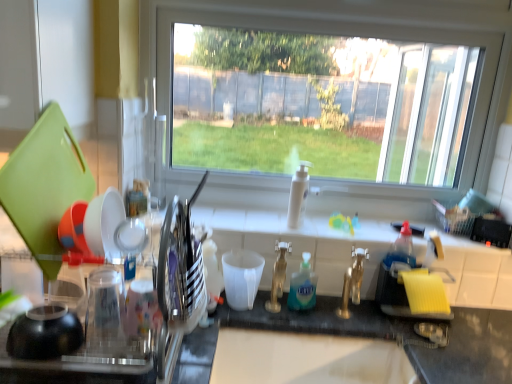
This screenshot has height=384, width=512. Describe the element at coordinates (303, 287) in the screenshot. I see `blue translucent liquid soap at center` at that location.

The width and height of the screenshot is (512, 384). I want to click on gold metallic faucet at center, so click(x=278, y=276).

What do you see at coordinates (180, 271) in the screenshot? This screenshot has height=384, width=512. I see `shiny silver utensil holder at left, the second tableware viewed from the left` at bounding box center [180, 271].

This screenshot has height=384, width=512. In order to click on clear plastic dish rack at left in this screenshot , I will do `click(45, 186)`.

What do you see at coordinates (352, 282) in the screenshot? The width and height of the screenshot is (512, 384). I see `gold metallic faucet at center` at bounding box center [352, 282].

Where is `blue translucent liquid soap at center`? The height and width of the screenshot is (384, 512). blue translucent liquid soap at center is located at coordinates (303, 287).

Considering their positions, is white matte measuring cup at center, the 1th tableware in the right-to-left sequence, located in front of or behind blue translucent liquid soap at center?

Visually, white matte measuring cup at center, the 1th tableware in the right-to-left sequence, is located in front of blue translucent liquid soap at center.

Can you tell me how much white matte measuring cup at center, the 3th tableware in the left-to-right sequence, and blue translucent liquid soap at center differ in facing direction?

The angular difference between white matte measuring cup at center, the 3th tableware in the left-to-right sequence, and blue translucent liquid soap at center is 2.07 degrees.

Is white matte measuring cup at center, the 1th tableware in the right-to-left sequence, oriented away from blue translucent liquid soap at center?

No, white matte measuring cup at center, the 1th tableware in the right-to-left sequence, is not facing away from blue translucent liquid soap at center.

Is point (254, 284) closer to camera compared to point (291, 276)?

Yes, it is in front of point (291, 276).

Could you tell me if blue translucent liquid soap at center is turned towards gold metallic faucet at center?

No.

How many degrees apart are the facing directions of blue translucent liquid soap at center and gold metallic faucet at center?

blue translucent liquid soap at center and gold metallic faucet at center are facing 2.98 degrees away from each other.

Based on the photo, from the image's perspective, is blue translucent liquid soap at center under gold metallic faucet at center?

Yes, from the image's perspective, blue translucent liquid soap at center is below gold metallic faucet at center.

Which object is further away from the camera taking this photo, blue translucent liquid soap at center or gold metallic faucet at center?

blue translucent liquid soap at center.

From a real-world perspective, does blue translucent liquid soap at center stand above white glossy bowl at left, arranged as the 3th tableware when viewed from the right?

Incorrect, from a real-world perspective, blue translucent liquid soap at center is lower than white glossy bowl at left, arranged as the 3th tableware when viewed from the right.

Would you say blue translucent liquid soap at center is inside or outside white glossy bowl at left, the 1th tableware positioned from the left?

The correct answer is: outside.

Is blue translucent liquid soap at center closer to the viewer compared to white glossy bowl at left, arranged as the 3th tableware when viewed from the right?

No.

In the scene shown: From the image's perspective, which one is positioned lower, blue translucent liquid soap at center or white glossy bowl at left, the 1th tableware positioned from the left?

From the image's view, blue translucent liquid soap at center is below.

Between white glossy bowl at left, the 1th tableware positioned from the left, and shiny silver utensil holder at left, the second tableware viewed from the left, which one appears on the right side from the viewer's perspective?

shiny silver utensil holder at left, the second tableware viewed from the left, is more to the right.

Could you tell me if white glossy bowl at left, the 1th tableware positioned from the left, is turned towards shiny silver utensil holder at left, the second tableware viewed from the left?

Yes, white glossy bowl at left, the 1th tableware positioned from the left, is facing shiny silver utensil holder at left, the second tableware viewed from the left.

Is white glossy bowl at left, the 1th tableware positioned from the left, positioned far away from shiny silver utensil holder at left, the second tableware when ordered from right to left?

No, white glossy bowl at left, the 1th tableware positioned from the left, is in close proximity to shiny silver utensil holder at left, the second tableware when ordered from right to left.

Is white glossy bowl at left, arranged as the 3th tableware when viewed from the right, not inside shiny silver utensil holder at left, the second tableware when ordered from right to left?

Yes, white glossy bowl at left, arranged as the 3th tableware when viewed from the right, is outside of shiny silver utensil holder at left, the second tableware when ordered from right to left.

I want to click on tableware above the white glossy soap dispenser at center (from a real-world perspective), so click(102, 228).

Between point (290, 196) and point (116, 249), which one is positioned in front?

Positioned in front is point (116, 249).

Looking at their sizes, would you say white glossy soap dispenser at center is wider or thinner than white glossy bowl at left, arranged as the 3th tableware when viewed from the right?

In the image, white glossy soap dispenser at center appears to be more narrow than white glossy bowl at left, arranged as the 3th tableware when viewed from the right.

Between white glossy soap dispenser at center and white glossy bowl at left, arranged as the 3th tableware when viewed from the right, which one appears on the left side from the viewer's perspective?

Positioned to the left is white glossy bowl at left, arranged as the 3th tableware when viewed from the right.

In the scene shown: Is clear plastic dish rack at left smaller than white glossy bowl at left, arranged as the 3th tableware when viewed from the right?

Actually, clear plastic dish rack at left might be larger than white glossy bowl at left, arranged as the 3th tableware when viewed from the right.

From a real-world perspective, is clear plastic dish rack at left above or below white glossy bowl at left, arranged as the 3th tableware when viewed from the right?

clear plastic dish rack at left is below white glossy bowl at left, arranged as the 3th tableware when viewed from the right.

From a real-world perspective, which tableware is the 2nd one above the clear plastic dish rack at left? Please provide its 2D coordinates.

[(102, 228)]

Is point (114, 231) closer to camera compared to point (106, 218)?

That is False.

How different are the orientations of white glossy bowl at left, arranged as the 3th tableware when viewed from the right, and gold metallic faucet at center in degrees?

The facing directions of white glossy bowl at left, arranged as the 3th tableware when viewed from the right, and gold metallic faucet at center are 91.9 degrees apart.

Does white glossy bowl at left, arranged as the 3th tableware when viewed from the right, have a greater height compared to gold metallic faucet at center?

Incorrect, the height of white glossy bowl at left, arranged as the 3th tableware when viewed from the right, is not larger of that of gold metallic faucet at center.

Is gold metallic faucet at center inside white glossy bowl at left, the 1th tableware positioned from the left?

That's incorrect, gold metallic faucet at center is not inside white glossy bowl at left, the 1th tableware positioned from the left.

At what (x,y) coordinates should I click in order to perform the action: click on cleaning product that appears behind the white matte measuring cup at center, the 1th tableware in the right-to-left sequence. Please return your answer as a coordinate pair (x, y). Image resolution: width=512 pixels, height=384 pixels. Looking at the image, I should click on (303, 287).

This screenshot has width=512, height=384. In order to click on faucet that is above the blue translucent liquid soap at center (from the image's perspective) in this screenshot , I will do pyautogui.click(x=278, y=276).

Looking at the image, which one is located closer to white glossy soap dispenser at center, white matte measuring cup at center, the 1th tableware in the right-to-left sequence, or gold metallic faucet at center?

gold metallic faucet at center is positioned closer to the anchor white glossy soap dispenser at center.

Estimate the real-world distances between objects in this image. Which object is further from white matte measuring cup at center, the 3th tableware in the left-to-right sequence, blue translucent liquid soap at center or white glossy soap dispenser at center?

Among the two, white glossy soap dispenser at center is located further to white matte measuring cup at center, the 3th tableware in the left-to-right sequence.

In the scene shown: When comparing their distances from gold metallic faucet at center, does shiny silver utensil holder at left, the second tableware when ordered from right to left, or white glossy bowl at left, arranged as the 3th tableware when viewed from the right, seem closer?

shiny silver utensil holder at left, the second tableware when ordered from right to left.

Looking at the image, which one is located further to white glossy soap dispenser at center, gold metallic faucet at center or white matte measuring cup at center, the 1th tableware in the right-to-left sequence?

Based on the image, gold metallic faucet at center appears to be further to white glossy soap dispenser at center.

Considering their positions, is white glossy bowl at left, arranged as the 3th tableware when viewed from the right, positioned further to gold metallic faucet at center than blue translucent liquid soap at center?

white glossy bowl at left, arranged as the 3th tableware when viewed from the right, is positioned further to the anchor gold metallic faucet at center.

When comparing their distances from gold metallic faucet at center, does white glossy bowl at left, the 1th tableware positioned from the left, or shiny silver utensil holder at left, the second tableware when ordered from right to left, seem closer?

The object closer to gold metallic faucet at center is shiny silver utensil holder at left, the second tableware when ordered from right to left.

Estimate the real-world distances between objects in this image. Which object is closer to blue translucent liquid soap at center, gold metallic faucet at center or gold metallic faucet at center?

gold metallic faucet at center is positioned closer to the anchor blue translucent liquid soap at center.

Estimate the real-world distances between objects in this image. Which object is further from gold metallic faucet at center, blue translucent liquid soap at center or shiny silver utensil holder at left, the second tableware when ordered from right to left?

shiny silver utensil holder at left, the second tableware when ordered from right to left, is further to gold metallic faucet at center.

Where is `soap dispenser between transparent glass window at center and blue translucent liquid soap at center in the up-down direction`? The width and height of the screenshot is (512, 384). soap dispenser between transparent glass window at center and blue translucent liquid soap at center in the up-down direction is located at coordinates (298, 195).

At what (x,y) coordinates should I click in order to perform the action: click on soap dispenser between clear plastic dish rack at left and transparent glass window at center from left to right. Please return your answer as a coordinate pair (x, y). Looking at the image, I should click on (298, 195).

Locate an element on the screen. faucet between shiny silver utensil holder at left, the second tableware viewed from the left, and white glossy soap dispenser at center in the front-back direction is located at coordinates (278, 276).

Where is `cleaning product between white glossy bowl at left, arranged as the 3th tableware when viewed from the right, and gold metallic faucet at center, in the horizontal direction`? The height and width of the screenshot is (384, 512). cleaning product between white glossy bowl at left, arranged as the 3th tableware when viewed from the right, and gold metallic faucet at center, in the horizontal direction is located at coordinates 303,287.